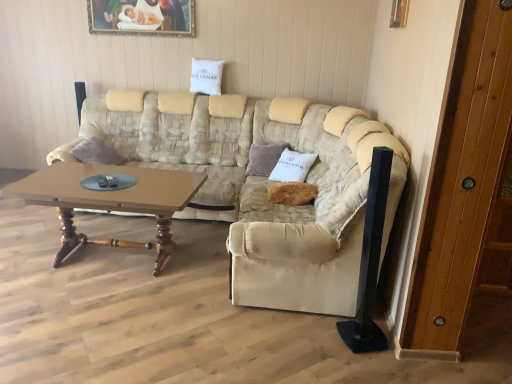
Question: From a real-world perspective, is brown wooden coffee table at center under beige fabric armchair at center?

Choices:
 (A) yes
 (B) no

Answer: (A)

Question: From the image's perspective, would you say brown wooden coffee table at center is positioned over beige fabric armchair at center?

Choices:
 (A) yes
 (B) no

Answer: (B)

Question: Considering the relative sizes of brown wooden coffee table at center and beige fabric armchair at center in the image provided, is brown wooden coffee table at center taller than beige fabric armchair at center?

Choices:
 (A) yes
 (B) no

Answer: (B)

Question: Is brown wooden coffee table at center oriented away from beige fabric armchair at center?

Choices:
 (A) no
 (B) yes

Answer: (A)

Question: Does brown wooden coffee table at center have a smaller size compared to beige fabric armchair at center?

Choices:
 (A) no
 (B) yes

Answer: (B)

Question: Relative to beige fabric couch at center, is beige fabric armchair at center in front or behind?

Choices:
 (A) front
 (B) behind

Answer: (B)

Question: Considering the positions of point (242, 281) and point (285, 304), is point (242, 281) closer or farther from the camera than point (285, 304)?

Choices:
 (A) farther
 (B) closer

Answer: (B)

Question: From the image's perspective, is beige fabric armchair at center above or below beige fabric couch at center?

Choices:
 (A) below
 (B) above

Answer: (A)

Question: From a real-world perspective, is beige fabric armchair at center above or below beige fabric couch at center?

Choices:
 (A) below
 (B) above

Answer: (B)

Question: Is wooden painted picture frame at upper center, placed as the 1th picture frame when sorted from left to right, spatially inside beige fabric couch at center, or outside of it?

Choices:
 (A) outside
 (B) inside

Answer: (A)

Question: Looking at their shapes, would you say wooden painted picture frame at upper center, which ranks as the second picture frame in front-to-back order, is wider or thinner than beige fabric couch at center?

Choices:
 (A) thin
 (B) wide

Answer: (A)

Question: Does point (144, 6) appear closer or farther from the camera than point (134, 125)?

Choices:
 (A) closer
 (B) farther

Answer: (A)

Question: In terms of height, does wooden painted picture frame at upper center, the 1th picture frame in the back-to-front sequence, look taller or shorter compared to beige fabric couch at center?

Choices:
 (A) short
 (B) tall

Answer: (A)

Question: Is point (476, 3) closer or farther from the camera than point (281, 150)?

Choices:
 (A) closer
 (B) farther

Answer: (A)

Question: From the image's perspective, relative to velvet purple pillow at center, the second pillow from the bottom, is wooden door at right above or below?

Choices:
 (A) below
 (B) above

Answer: (A)